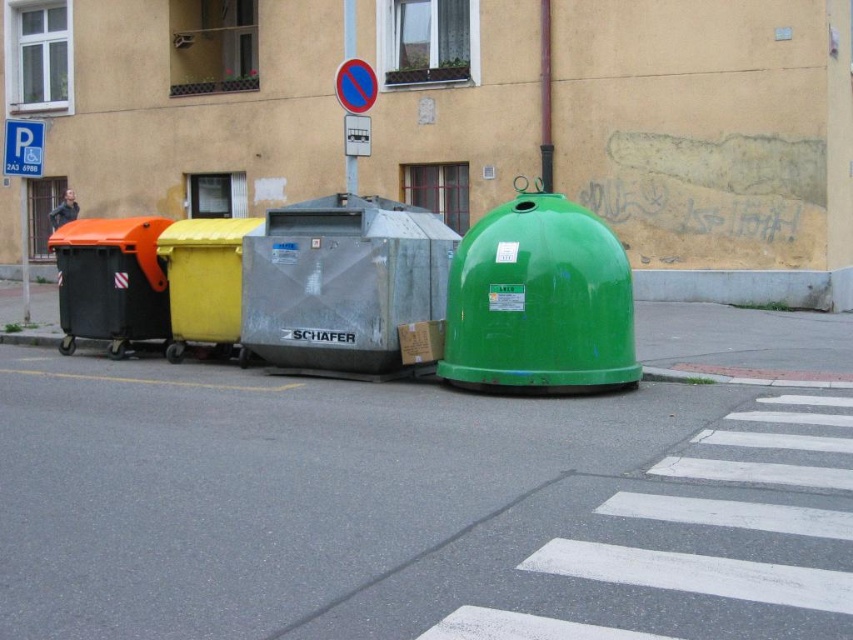
You are a delivery person trying to determine which recycling bin to use. The green matte recycling bin at center and the metallic gray recycling bin at center are both in front of you. Which one is shorter?

The green matte recycling bin at center is not as tall as metallic gray recycling bin at center, so the green matte recycling bin at center is shorter.

You are standing at the pedestrian crossing and see the green matte recycling bin at center. If you walk straight towards it, how far will you have to walk to reach it?

The green matte recycling bin at center is 9.30 meters away from the viewer, so you will have to walk 9.30 meters to reach it.